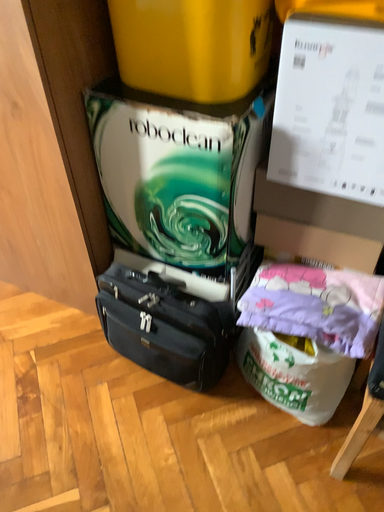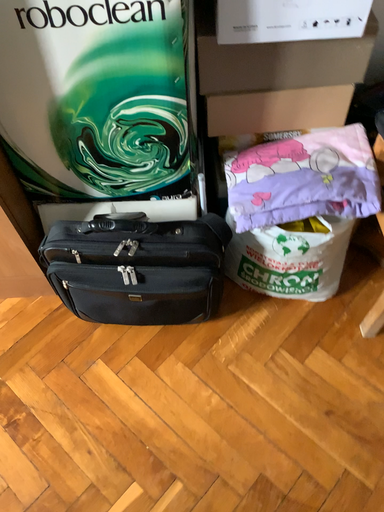
Question: Which way did the camera rotate in the video?

Choices:
 (A) rotated downward
 (B) rotated upward

Answer: (A)